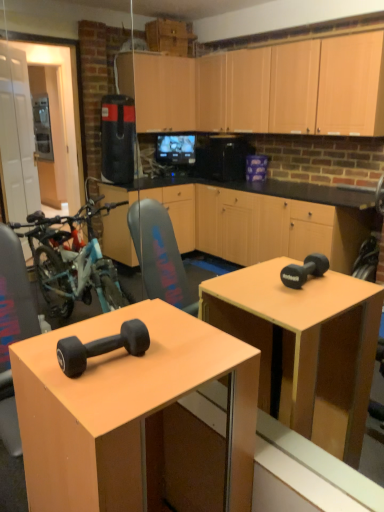
Question: Should I look upward or downward to see matte black dumbbell at center?

Choices:
 (A) down
 (B) up

Answer: (A)

Question: Is black rubber dumbbell at lower left positioned in front of matte black dumbbell at center?

Choices:
 (A) yes
 (B) no

Answer: (B)

Question: From the image's perspective, would you say black rubber dumbbell at lower left is positioned over matte black dumbbell at center?

Choices:
 (A) no
 (B) yes

Answer: (B)

Question: Is black rubber dumbbell at lower left smaller than matte black dumbbell at center?

Choices:
 (A) yes
 (B) no

Answer: (A)

Question: Does black rubber dumbbell at lower left come behind matte black dumbbell at center?

Choices:
 (A) no
 (B) yes

Answer: (B)

Question: Is black rubber dumbbell at lower left completely or partially outside of matte black dumbbell at center?

Choices:
 (A) yes
 (B) no

Answer: (A)

Question: Does black rubber dumbbell at lower left turn towards matte black dumbbell at center?

Choices:
 (A) no
 (B) yes

Answer: (A)

Question: From a real-world perspective, is matte black dumbbell at center positioned under black rubber dumbbell at lower left based on gravity?

Choices:
 (A) yes
 (B) no

Answer: (A)

Question: From a real-world perspective, is matte black dumbbell at center on black rubber dumbbell at lower left?

Choices:
 (A) no
 (B) yes

Answer: (A)

Question: From the image's perspective, is matte black dumbbell at center below black rubber dumbbell at lower left?

Choices:
 (A) yes
 (B) no

Answer: (A)

Question: Is matte black dumbbell at center at the right side of black rubber dumbbell at lower left?

Choices:
 (A) yes
 (B) no

Answer: (A)

Question: Is matte black dumbbell at center directly adjacent to black rubber dumbbell at lower left?

Choices:
 (A) yes
 (B) no

Answer: (B)

Question: Would you say matte black dumbbell at center is outside black rubber dumbbell at lower left?

Choices:
 (A) yes
 (B) no

Answer: (A)

Question: From a real-world perspective, relative to matte black dumbbell at center, is black rubber dumbbell at lower left vertically above or below?

Choices:
 (A) below
 (B) above

Answer: (B)